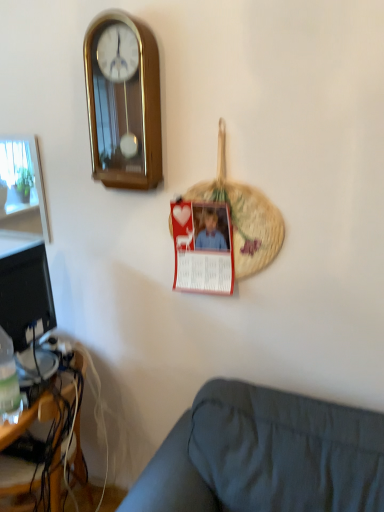
What do you see at coordinates (8, 376) in the screenshot?
I see `translucent plastic bottle at lower left` at bounding box center [8, 376].

This screenshot has width=384, height=512. In order to click on wooden desk at lower left in this screenshot , I will do `click(15, 482)`.

This screenshot has width=384, height=512. What are the coordinates of `red paper postcard at center` in the screenshot? It's located at (203, 248).

In order to click on dark gray fabric couch at lower right in this screenshot , I will do `click(265, 455)`.

The width and height of the screenshot is (384, 512). What do you see at coordinates (123, 101) in the screenshot?
I see `gold polished wood wall clock at upper left` at bounding box center [123, 101].

This screenshot has height=512, width=384. I want to click on translucent plastic bottle at lower left, so click(x=8, y=376).

Are red paper postcard at center and dark gray fabric couch at lower right located far from each other?

red paper postcard at center is near dark gray fabric couch at lower right, not far away.

Does red paper postcard at center have a greater width compared to dark gray fabric couch at lower right?

No, red paper postcard at center is not wider than dark gray fabric couch at lower right.

Does translucent plastic bottle at lower left have a lesser height compared to gold polished wood wall clock at upper left?

Yes.

From the image's perspective, which one is positioned lower, translucent plastic bottle at lower left or gold polished wood wall clock at upper left?

From the image's view, translucent plastic bottle at lower left is below.

Can we say translucent plastic bottle at lower left lies outside gold polished wood wall clock at upper left?

Yes.

Which of these two, red paper postcard at center or translucent plastic bottle at lower left, is smaller?

Smaller between the two is translucent plastic bottle at lower left.

Is point (192, 253) positioned in front of point (8, 411)?

No, (192, 253) is behind (8, 411).

From the image's perspective, is red paper postcard at center above or below translucent plastic bottle at lower left?

From the image's perspective, red paper postcard at center appears above translucent plastic bottle at lower left.

Considering the points (5, 334) and (182, 220), which point is in front, point (5, 334) or point (182, 220)?

Point (5, 334)

Would you say translucent plastic bottle at lower left is inside or outside red paper postcard at center?

translucent plastic bottle at lower left is located beyond the bounds of red paper postcard at center.

Could you tell me if translucent plastic bottle at lower left is turned towards red paper postcard at center?

No, translucent plastic bottle at lower left is not turned towards red paper postcard at center.

From a real-world perspective, is translucent plastic bottle at lower left on top of red paper postcard at center?

No, from a real-world perspective, translucent plastic bottle at lower left is not on top of red paper postcard at center.

From a real-world perspective, is red paper postcard at center physically located above or below wooden desk at lower left?

Clearly, from a real-world perspective, red paper postcard at center is above wooden desk at lower left.

Between red paper postcard at center and wooden desk at lower left, which one has larger width?

Wider between the two is wooden desk at lower left.

Can you confirm if red paper postcard at center is shorter than wooden desk at lower left?

Yes, red paper postcard at center is shorter than wooden desk at lower left.

Does point (222, 249) appear closer or farther from the camera than point (79, 429)?

Point (222, 249) appears to be closer to the viewer than point (79, 429).

You are a GUI agent. You are given a task and a screenshot of the screen. Output one action in this format:
    pyautogui.click(x=<x>, y=<y>)
    Task: Click on the desk behind the dark gray fabric couch at lower right
    
    Given the screenshot: What is the action you would take?
    pyautogui.click(x=15, y=482)

Is wooden desk at lower left not inside dark gray fabric couch at lower right?

wooden desk at lower left is positioned outside dark gray fabric couch at lower right.

Where is `bottle that is above the dark gray fabric couch at lower right (from a real-world perspective)`? The width and height of the screenshot is (384, 512). bottle that is above the dark gray fabric couch at lower right (from a real-world perspective) is located at coordinates (8, 376).

Does translucent plastic bottle at lower left have a lesser height compared to dark gray fabric couch at lower right?

Correct, translucent plastic bottle at lower left is not as tall as dark gray fabric couch at lower right.

Would you consider translucent plastic bottle at lower left to be distant from dark gray fabric couch at lower right?

translucent plastic bottle at lower left is near dark gray fabric couch at lower right, not far away.

Locate an element on the screen. postcard that appears above the dark gray fabric couch at lower right (from the image's perspective) is located at coordinates (203, 248).

Where is `bottle that appears below the gold polished wood wall clock at upper left (from the image's perspective)`? The image size is (384, 512). bottle that appears below the gold polished wood wall clock at upper left (from the image's perspective) is located at coordinates (8, 376).

Estimate the real-world distances between objects in this image. Which object is further from translucent plastic bottle at lower left, wooden desk at lower left or red paper postcard at center?

red paper postcard at center lies further to translucent plastic bottle at lower left than the other object.

Looking at the image, which one is located closer to wooden desk at lower left, dark gray fabric couch at lower right or gold polished wood wall clock at upper left?

dark gray fabric couch at lower right is closer to wooden desk at lower left.

Looking at the image, which one is located closer to red paper postcard at center, gold polished wood wall clock at upper left or translucent plastic bottle at lower left?

gold polished wood wall clock at upper left lies closer to red paper postcard at center than the other object.

Which object lies further to the anchor point wooden desk at lower left, red paper postcard at center or gold polished wood wall clock at upper left?

Based on the image, gold polished wood wall clock at upper left appears to be further to wooden desk at lower left.

When comparing their distances from wooden desk at lower left, does translucent plastic bottle at lower left or dark gray fabric couch at lower right seem closer?

translucent plastic bottle at lower left is closer to wooden desk at lower left.

When comparing their distances from gold polished wood wall clock at upper left, does wooden desk at lower left or translucent plastic bottle at lower left seem closer?

translucent plastic bottle at lower left is closer to gold polished wood wall clock at upper left.

Looking at the image, which one is located further to translucent plastic bottle at lower left, dark gray fabric couch at lower right or wooden desk at lower left?

dark gray fabric couch at lower right.

Based on their spatial positions, is wooden desk at lower left or red paper postcard at center further from dark gray fabric couch at lower right?

The object further to dark gray fabric couch at lower right is wooden desk at lower left.

Locate an element on the screen. bottle between red paper postcard at center and wooden desk at lower left in the up-down direction is located at coordinates (8, 376).

Find the location of `postcard between gold polished wood wall clock at upper left and dark gray fabric couch at lower right vertically`. postcard between gold polished wood wall clock at upper left and dark gray fabric couch at lower right vertically is located at coordinates (203, 248).

Identify the location of desk between gold polished wood wall clock at upper left and dark gray fabric couch at lower right from top to bottom. (15, 482).

What are the coordinates of `postcard that lies between gold polished wood wall clock at upper left and translucent plastic bottle at lower left from top to bottom` in the screenshot? It's located at (203, 248).